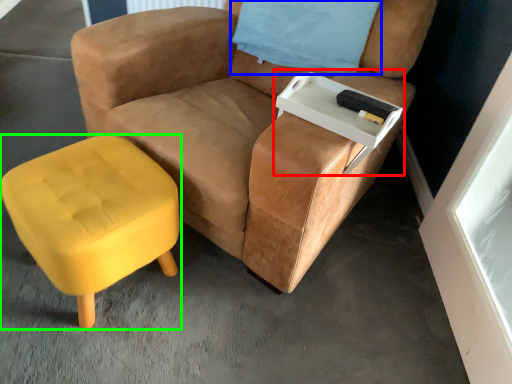
Question: Estimate the real-world distances between objects in this image. Which object is closer to side table (highlighted by a red box), pillow (highlighted by a blue box) or stool (highlighted by a green box)?

Choices:
 (A) pillow
 (B) stool

Answer: (A)